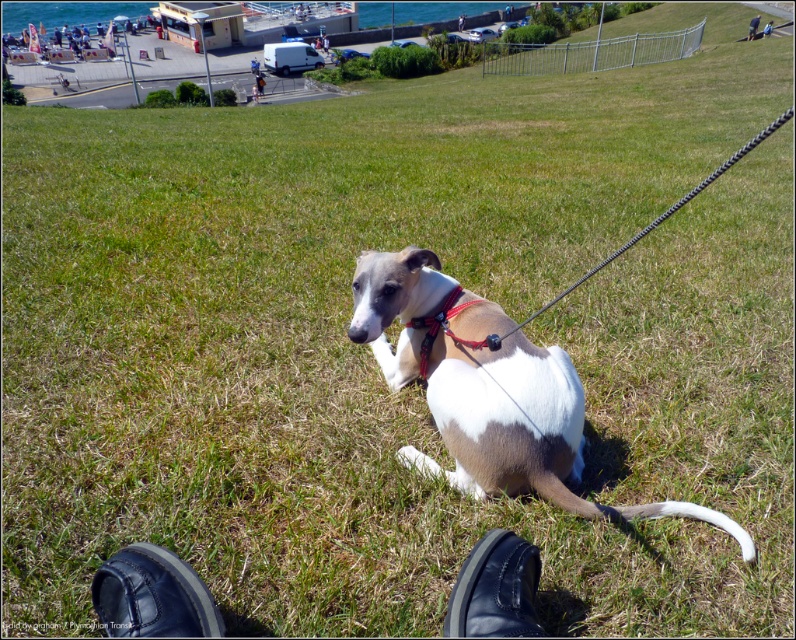
Is brown and white fur at center smaller than red nylon collar at center?

No.

Who is more forward, (391, 305) or (490, 344)?

Positioned in front is point (490, 344).

Is point (400, 368) farther from viewer compared to point (436, 317)?

Yes, point (400, 368) is behind point (436, 317).

Locate an element on the screen. The width and height of the screenshot is (796, 640). brown and white fur at center is located at coordinates (488, 390).

Who is more forward, (139, 580) or (494, 340)?

Point (139, 580) is more forward.

Who is more distant from viewer, (174, 628) or (428, 333)?

The point (428, 333) is behind.

Find the location of a particular element. black leather shoe at lower left is located at coordinates (151, 595).

Between point (100, 580) and point (475, 609), which one is positioned in front?

Point (475, 609)

Is black leather shoe at lower left closer to the viewer compared to black leather shoe at lower center?

Yes.

Is point (193, 595) farther from viewer compared to point (533, 548)?

No, it is not.

You are a GUI agent. You are given a task and a screenshot of the screen. Output one action in this format:
    pyautogui.click(x=<x>, y=<y>)
    Task: Click on the black leather shoe at lower left
    
    Given the screenshot: What is the action you would take?
    pyautogui.click(x=151, y=595)